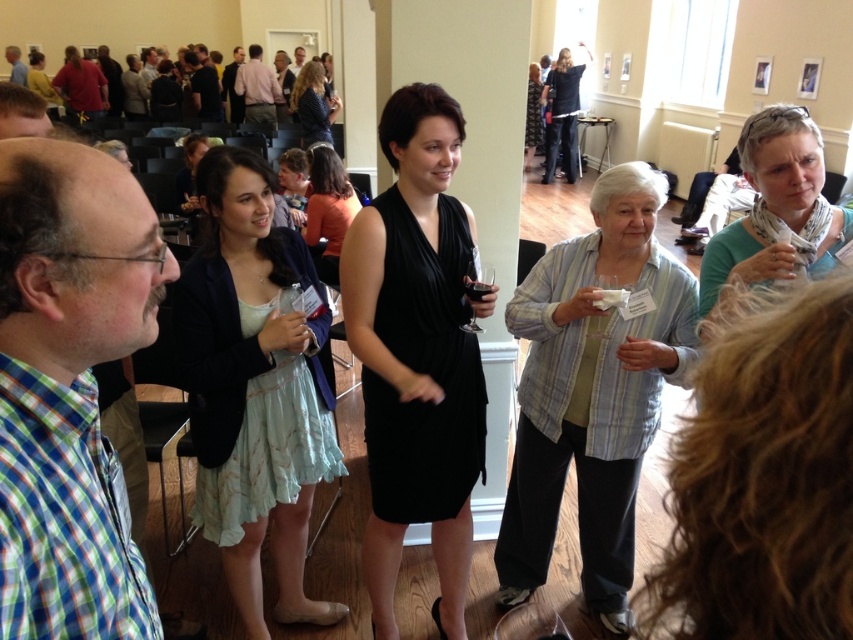
Can you confirm if black dress at center is positioned to the left of transparent glass at center?

Incorrect, black dress at center is not on the left side of transparent glass at center.

At what (x,y) coordinates should I click in order to perform the action: click on black dress at center. Please return your answer as a coordinate pair (x, y). The height and width of the screenshot is (640, 853). Looking at the image, I should click on (561, 115).

Identify the location of black dress at center. The width and height of the screenshot is (853, 640). (561, 115).

Is black satin dress at center smaller than orange fabric dress at center?

Yes, black satin dress at center is smaller than orange fabric dress at center.

Can you confirm if black satin dress at center is bigger than orange fabric dress at center?

No.

This screenshot has height=640, width=853. What do you see at coordinates (416, 355) in the screenshot?
I see `black satin dress at center` at bounding box center [416, 355].

Identify the location of black satin dress at center. (416, 355).

Can you confirm if pink shirt at center is bigger than matte black dress at center?

Yes, pink shirt at center is bigger than matte black dress at center.

Is pink shirt at center positioned at the back of matte black dress at center?

→ No, it is not.

Which is in front, point (259, 81) or point (41, 61)?

Point (259, 81) is more forward.

Where is `pink shirt at center`? pink shirt at center is located at coordinates (257, 88).